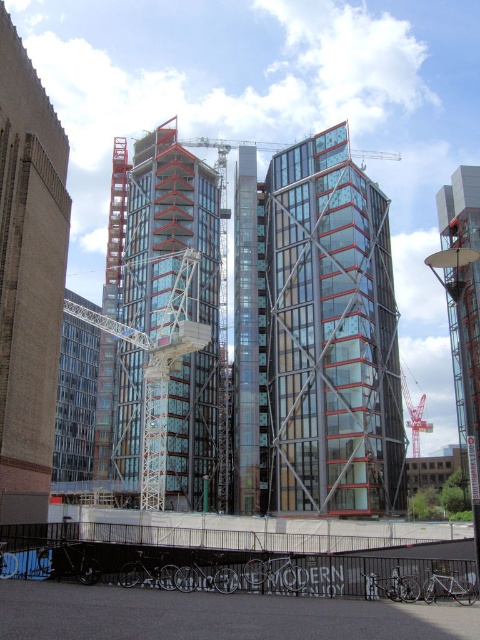
Where is `metallic scaffolding at lower center`? The width and height of the screenshot is (480, 640). metallic scaffolding at lower center is located at coordinates (239, 584).

Does point (162, 632) come closer to viewer compared to point (132, 460)?

Yes.

I want to click on metallic scaffolding at lower center, so click(239, 584).

Identify the location of glassy steel tower at center. The width and height of the screenshot is (480, 640). (169, 324).

Which is above, glassy steel tower at center or red metal crane at center?

glassy steel tower at center is above.

Where is `glassy steel tower at center`? glassy steel tower at center is located at coordinates (169, 324).

Identify the location of glassy steel tower at center. This screenshot has height=640, width=480. (169, 324).

Is glassy steel building at center wider than metallic scaffolding at lower center?

No, glassy steel building at center is not wider than metallic scaffolding at lower center.

Identify the location of glassy steel building at center. The image size is (480, 640). (331, 336).

The width and height of the screenshot is (480, 640). I want to click on glassy steel building at center, so click(331, 336).